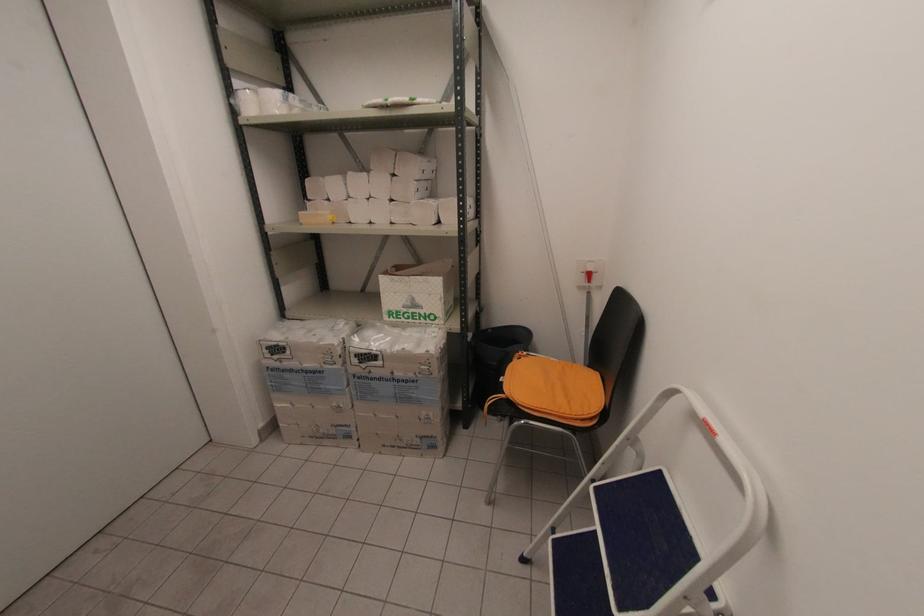
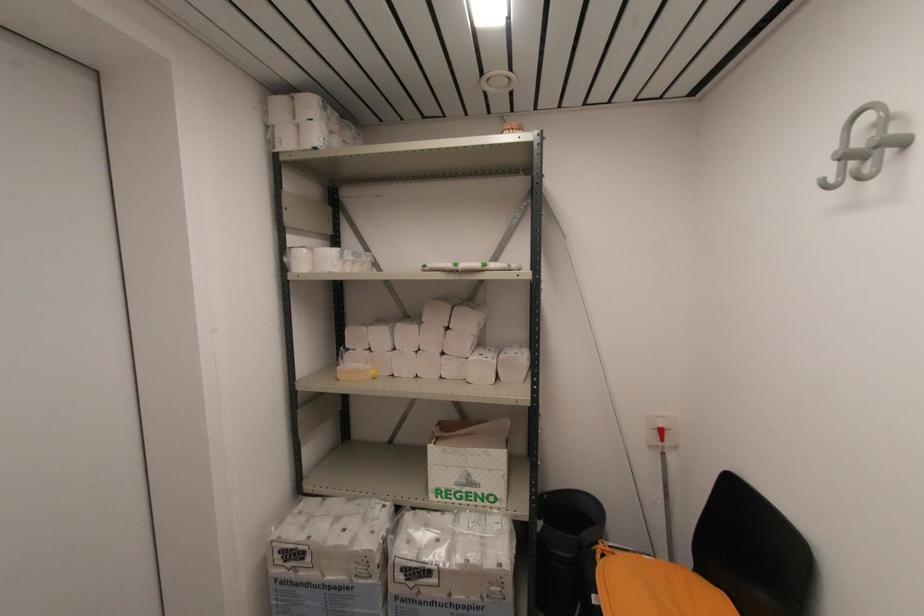
In the second image, find the point that corresponds to the point at 410,304 in the first image.

(465, 480)